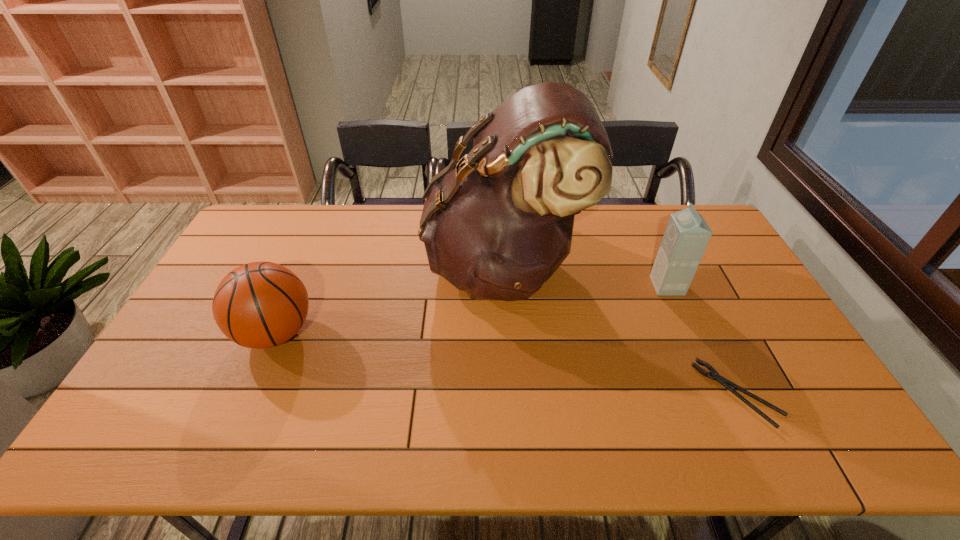
Where is `free space between the tongs and the third object from right to left`? This screenshot has height=540, width=960. free space between the tongs and the third object from right to left is located at coordinates (620, 330).

This screenshot has height=540, width=960. What are the coordinates of `vacant space in between the tongs and the satchel` in the screenshot? It's located at (620, 330).

Locate an element on the screen. This screenshot has height=540, width=960. free spot between the third shortest object and the leftmost object is located at coordinates (471, 310).

Identify which object is the second nearest to the third shortest object. Please provide its 2D coordinates. Your answer should be formatted as a tuple, i.e. [(x, y)], where the tuple contains the x and y coordinates of a point satisfying the conditions above.

[(714, 375)]

Select which object is the third closest to the tongs. Please provide its 2D coordinates. Your answer should be formatted as a tuple, i.e. [(x, y)], where the tuple contains the x and y coordinates of a point satisfying the conditions above.

[(258, 305)]

I want to click on free space that satisfies the following two spatial constraints: 1. on the front label of the third shortest object; 2. on the back side of the shortest object, so click(x=715, y=394).

Locate an element on the screen. The height and width of the screenshot is (540, 960). free space that satisfies the following two spatial constraints: 1. on the front label of the shortest object; 2. on the left side of the third shortest object is located at coordinates (715, 394).

Locate an element on the screen. The height and width of the screenshot is (540, 960). vacant space that satisfies the following two spatial constraints: 1. on the front label of the second tallest object; 2. on the front side of the basketball is located at coordinates (688, 334).

Where is `vacant space that satisfies the following two spatial constraints: 1. on the front side of the tongs; 2. on the left side of the leftmost object`? vacant space that satisfies the following two spatial constraints: 1. on the front side of the tongs; 2. on the left side of the leftmost object is located at coordinates (250, 394).

Identify the location of vacant region that satisfies the following two spatial constraints: 1. on the front label of the carton; 2. on the left side of the shortest object. The width and height of the screenshot is (960, 540). (715, 394).